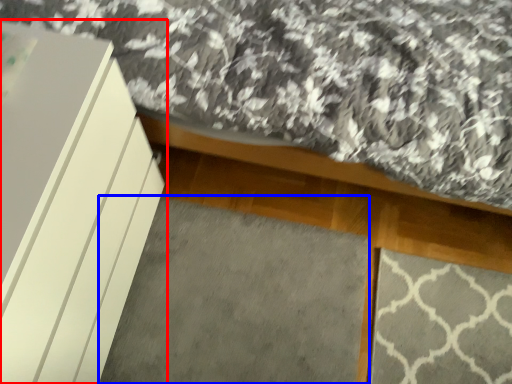
Question: Which object is further to the camera taking this photo, furniture (highlighted by a red box) or mat (highlighted by a blue box)?

Choices:
 (A) furniture
 (B) mat

Answer: (B)